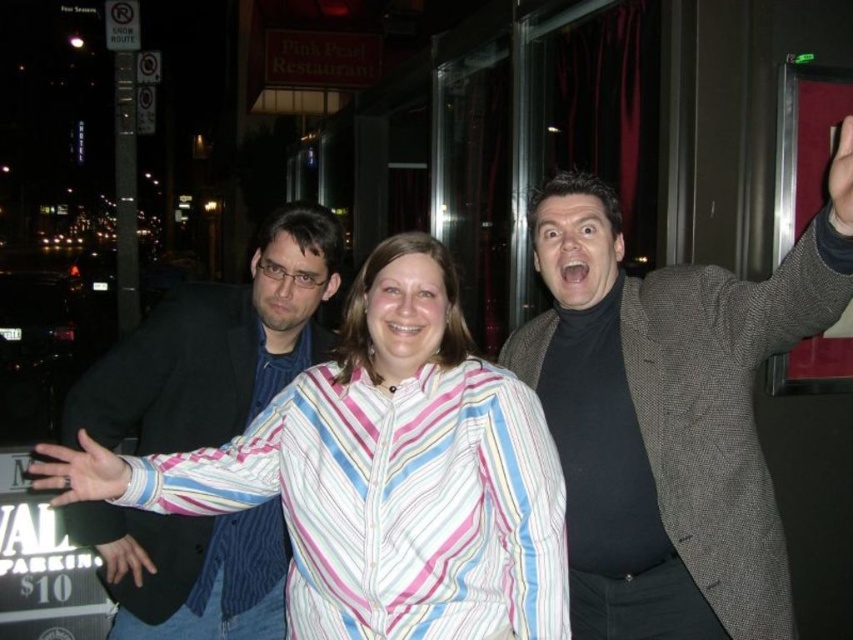
In the scene shown: You are a photographer trying to arrange two people wearing blazers for a photo. You have a dark gray textured blazer at right and a dark blue textured blazer at left. Based on the scene description, which blazer is positioned to the right of the other?

The dark gray textured blazer at right is positioned on the right side of the dark blue textured blazer at left.

You are a fashion stylist trying to choose between two blazers for a client. The client wants a blazer that is longer in length. Based on the image, which blazer should you recommend between the dark gray textured blazer at right and the dark blue textured blazer at left?

The dark blue textured blazer at left is longer than the dark gray textured blazer at right, so you should recommend the dark blue textured blazer at left for the client who wants a longer length.

You are a photographer trying to capture a group photo of two people wearing blazers. You need to ensure there is enough space between them for a natural pose. The minimum required distance between them should be 1.2 meters. Based on the scene, can you confirm if the distance between the dark gray textured blazer at right and the dark blue textured blazer at left meets this requirement?

The dark gray textured blazer at right and dark blue textured blazer at left are 1.29 meters apart from each other, which exceeds the minimum required distance of 1.2 meters. Therefore, the distance between them is sufficient for the natural pose.